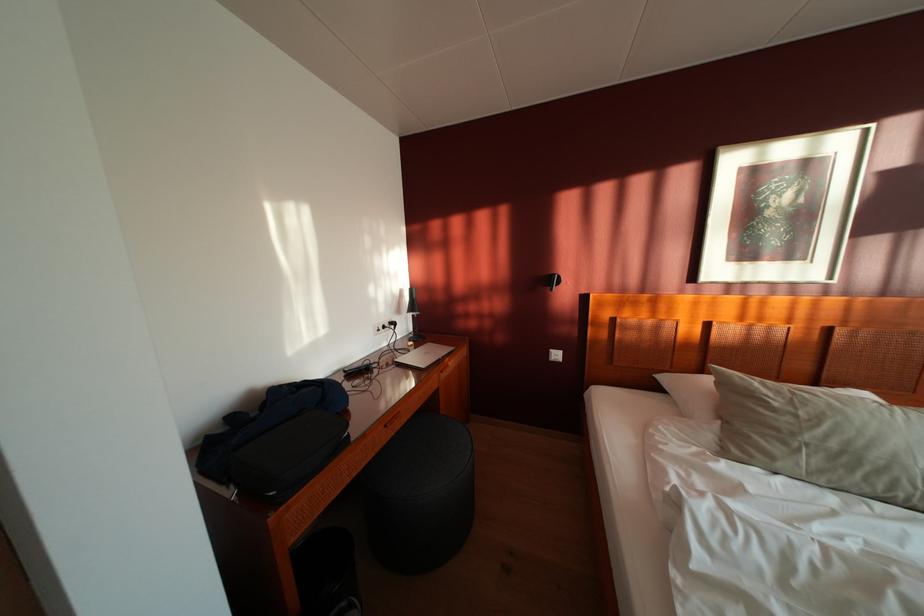
Where is `black travel case`? The width and height of the screenshot is (924, 616). black travel case is located at coordinates (265, 421).